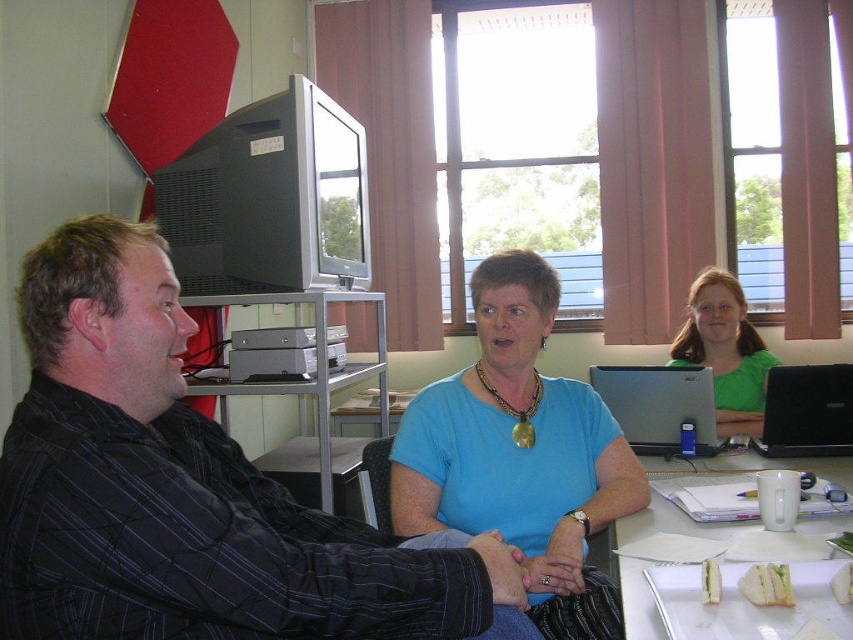
You are planning to place a new decorative item on the table. Given the sizes of the white paper plate at lower right and the metallic gray table at center, which object would be more suitable to place on the table without exceeding its dimensions?

The white paper plate at lower right has a larger width than the metallic gray table at center, so placing it on the table might not be suitable due to size constraints. The metallic gray table at center is smaller, so it would be better to place an item that fits within its dimensions.

You are organizing a small event and need to place a decorative item on the table. You have a white paper plate at lower right and a black plastic laptop at center right. Which object should you choose if you need something wider for your decoration?

The white paper plate at lower right might be wider than the black plastic laptop at center right, so it is the better choice for a wider decorative item.

You are a student who needs to place a notebook between the white paper plate at lower right and the black plastic laptop at center right. Can you fit it there?

The white paper plate at lower right and the black plastic laptop at center right are 8.01 inches apart, so yes, you can fit a notebook between them since the distance is sufficient.